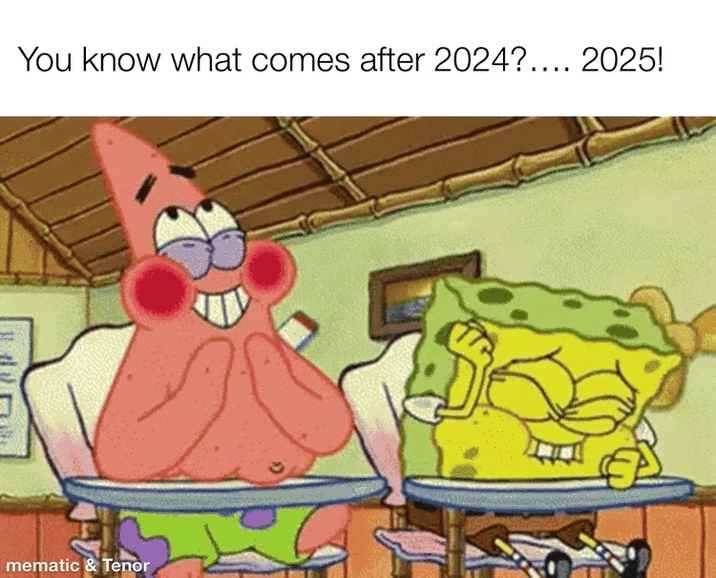
Image resolution: width=716 pixels, height=578 pixels. Find the location of `clam chairs`. clam chairs is located at coordinates click(82, 369), click(387, 395).